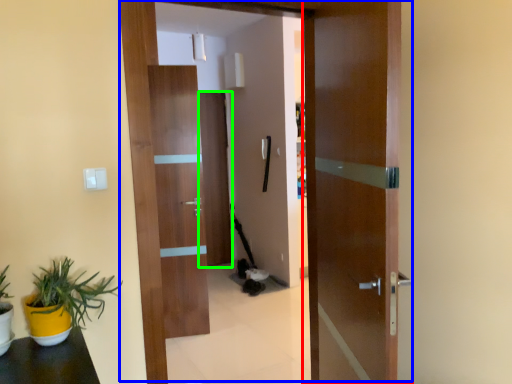
Question: Which is farther away from door (highlighted by a red box)? door (highlighted by a blue box) or door (highlighted by a green box)?

Choices:
 (A) door
 (B) door

Answer: (B)